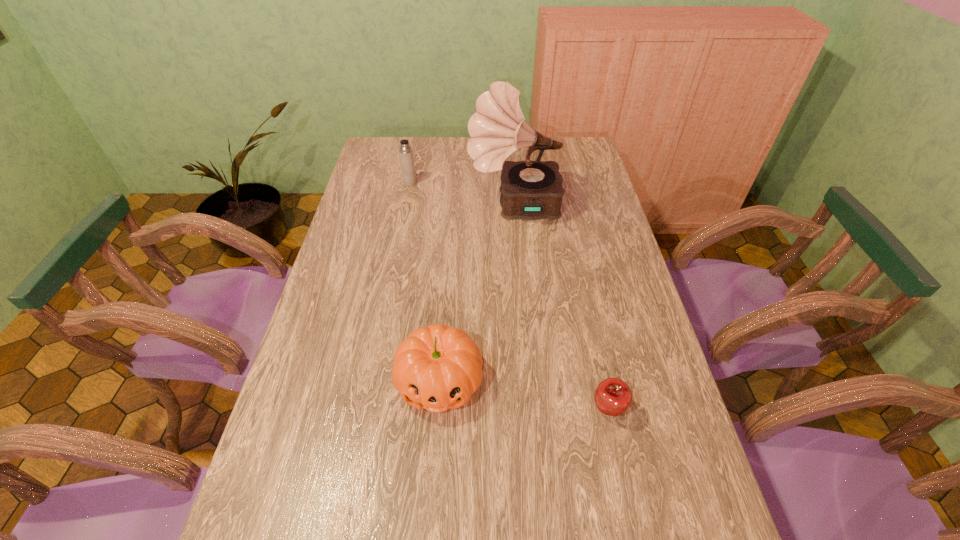
This screenshot has height=540, width=960. What are the coordinates of `object present at the right edge` in the screenshot? It's located at (613, 396).

Find the location of `vacant area at the far edge`. vacant area at the far edge is located at coordinates (427, 147).

Locate an element on the screen. free space at the left edge is located at coordinates (341, 283).

The image size is (960, 540). In the image, there is a desktop. What are the coordinates of `blank space at the right edge` in the screenshot? It's located at (601, 253).

The image size is (960, 540). What are the coordinates of `vacant space that's between the record player and the apple` in the screenshot? It's located at (561, 307).

The image size is (960, 540). I want to click on free spot between the leftmost object and the tallest object, so click(462, 194).

This screenshot has width=960, height=540. I want to click on vacant area that lies between the thermos bottle and the shortest object, so click(x=509, y=296).

The height and width of the screenshot is (540, 960). Find the location of `empty location between the shortest object and the record player`. empty location between the shortest object and the record player is located at coordinates (561, 307).

Find the location of a particular element. This screenshot has height=540, width=960. vacant point located between the leftmost object and the apple is located at coordinates (509, 296).

The width and height of the screenshot is (960, 540). What are the coordinates of `free space between the shortest object and the pumpkin` in the screenshot? It's located at (523, 395).